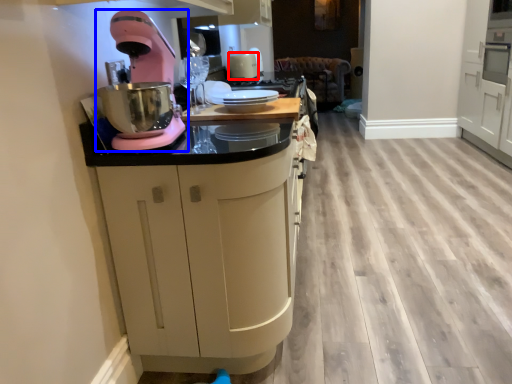
Question: Among these objects, which one is farthest to the camera, kitchen appliance (highlighted by a red box) or home appliance (highlighted by a blue box)?

Choices:
 (A) kitchen appliance
 (B) home appliance

Answer: (A)